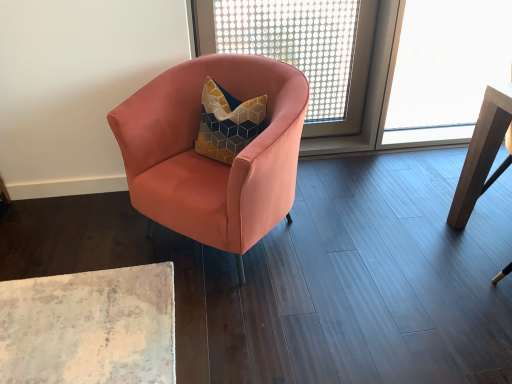
Where is `vacant space in between matte pink armchair at center and wooden table at right`? This screenshot has height=384, width=512. vacant space in between matte pink armchair at center and wooden table at right is located at coordinates (375, 223).